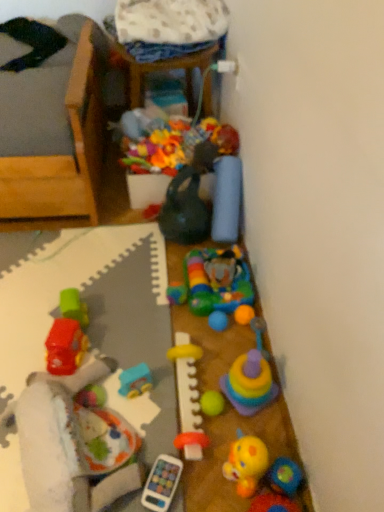
You are a GUI agent. You are given a task and a screenshot of the screen. Output one action in this format:
    pyautogui.click(x=<x>, y=<y>)
    Task: Click on the vacant space that is to the left of matte green kettle at center, marked as the ninth toy in a right-to-left arrangement
    
    Given the screenshot: What is the action you would take?
    pyautogui.click(x=134, y=237)